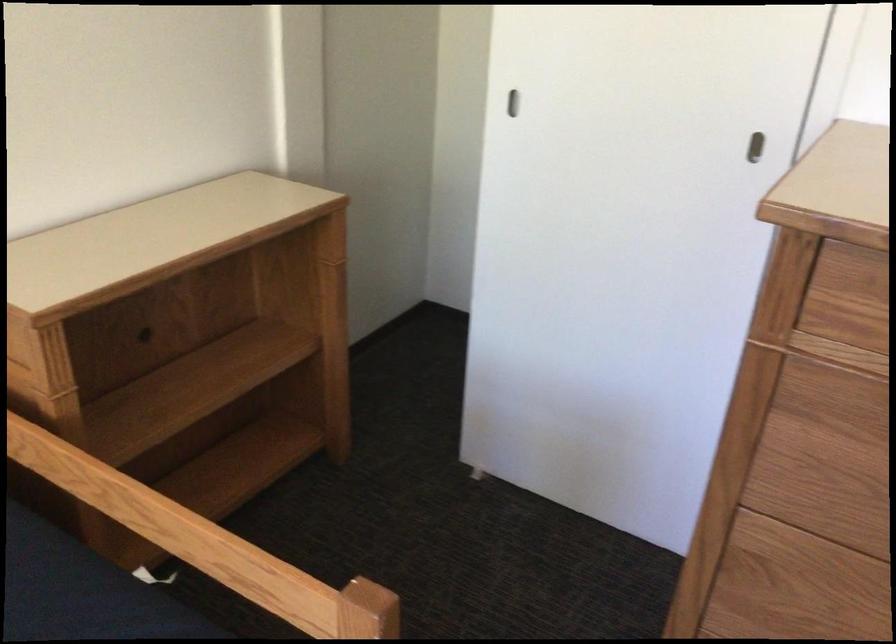
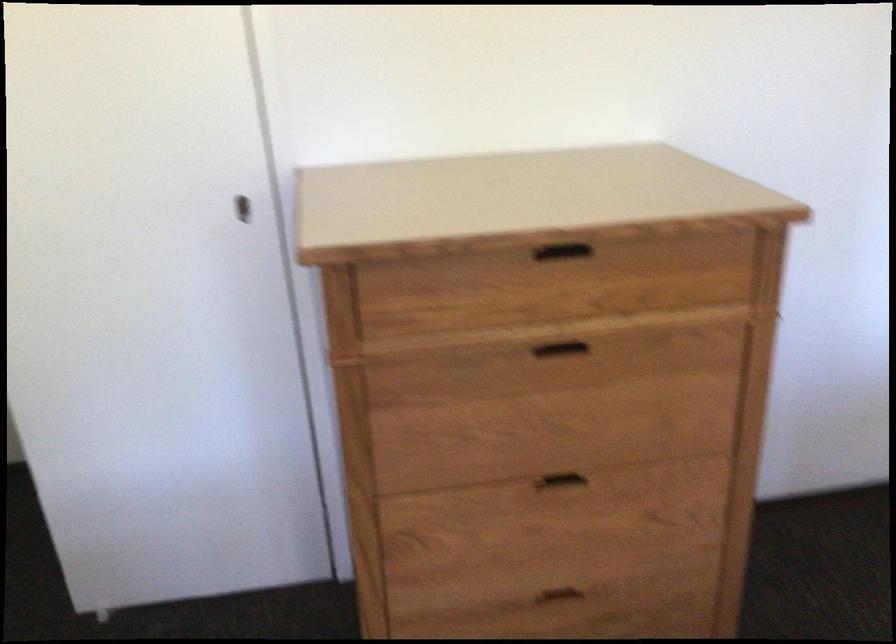
Question: The camera is either moving clockwise (left) or counter-clockwise (right) around the object. The first image is from the beginning of the video and the second image is from the end. Is the camera moving left or right when shooting the video?

Choices:
 (A) Left
 (B) Right

Answer: (A)